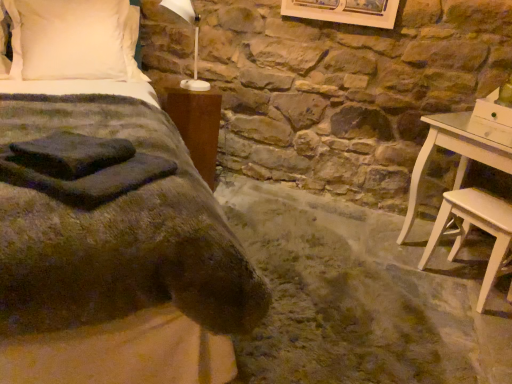
Question: Is white soft pillow at upper left positioned beyond the bounds of light wood stool at lower right?

Choices:
 (A) no
 (B) yes

Answer: (B)

Question: Is light wood stool at lower right a part of white soft pillow at upper left?

Choices:
 (A) no
 (B) yes

Answer: (A)

Question: Is white soft pillow at upper left to the right of light wood stool at lower right from the viewer's perspective?

Choices:
 (A) yes
 (B) no

Answer: (B)

Question: Can you confirm if white soft pillow at upper left is wider than light wood stool at lower right?

Choices:
 (A) no
 (B) yes

Answer: (B)

Question: Is white soft pillow at upper left facing away from light wood stool at lower right?

Choices:
 (A) no
 (B) yes

Answer: (A)

Question: Is white soft pillow at upper left positioned in front of light wood stool at lower right?

Choices:
 (A) no
 (B) yes

Answer: (A)

Question: From a real-world perspective, is brown wood nightstand at left on white soft pillow at upper left?

Choices:
 (A) no
 (B) yes

Answer: (A)

Question: Is brown wood nightstand at left further to the viewer compared to white soft pillow at upper left?

Choices:
 (A) yes
 (B) no

Answer: (A)

Question: Does brown wood nightstand at left have a smaller size compared to white soft pillow at upper left?

Choices:
 (A) no
 (B) yes

Answer: (B)

Question: Can we say brown wood nightstand at left lies outside white soft pillow at upper left?

Choices:
 (A) yes
 (B) no

Answer: (A)

Question: Is brown wood nightstand at left taller than white soft pillow at upper left?

Choices:
 (A) yes
 (B) no

Answer: (A)

Question: Is brown wood nightstand at left positioned with its back to white soft pillow at upper left?

Choices:
 (A) yes
 (B) no

Answer: (B)

Question: Are light wood stool at lower right and brown wood nightstand at left far apart?

Choices:
 (A) yes
 (B) no

Answer: (A)